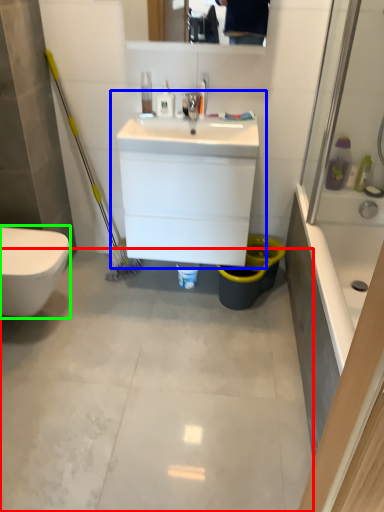
Question: Which object is positioned closest to concrete (highlighted by a red box)? Select from sink (highlighted by a blue box) and bidet (highlighted by a green box).

Choices:
 (A) sink
 (B) bidet

Answer: (B)